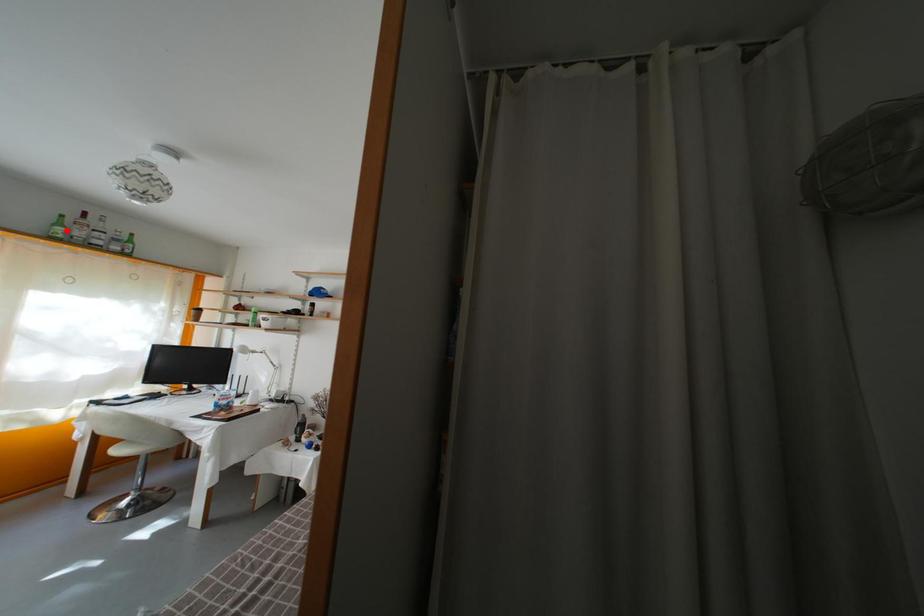
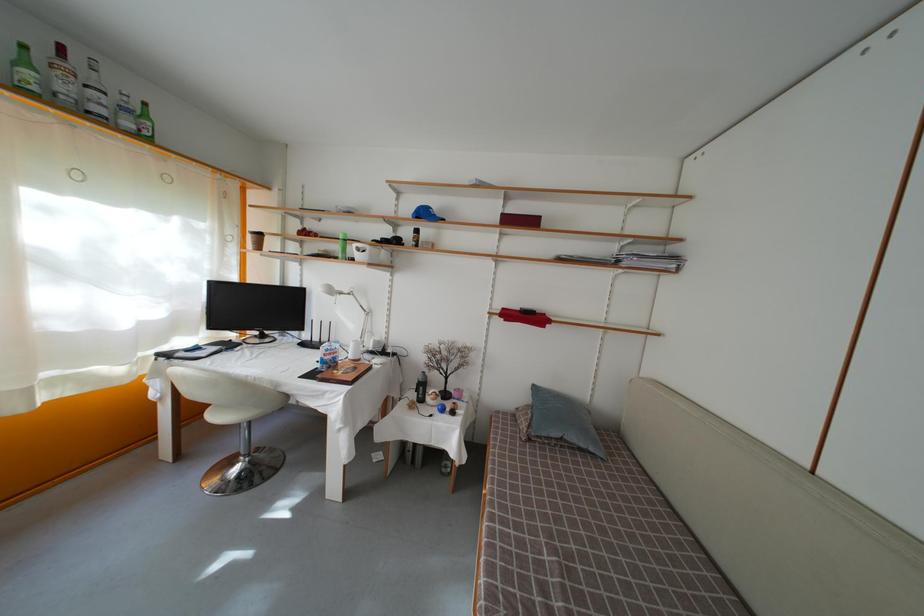
Where in the second image is the point corresponding to the highlighted location from the first image?

(31, 69)